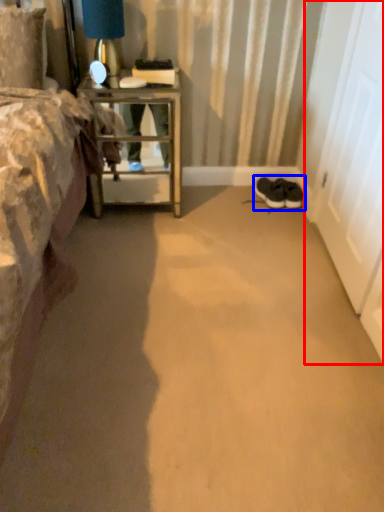
Question: Among these objects, which one is nearest to the camera, screen door (highlighted by a red box) or footwear (highlighted by a blue box)?

Choices:
 (A) screen door
 (B) footwear

Answer: (A)